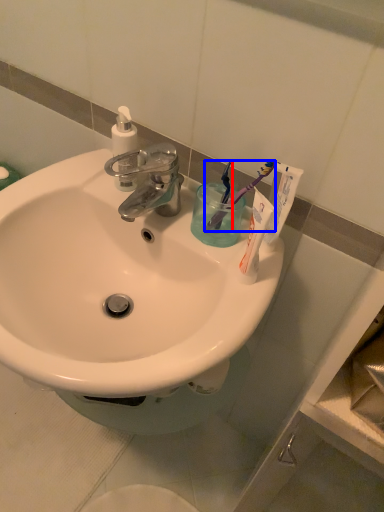
Question: Which object is closer to the camera taking this photo, toothbrush (highlighted by a red box) or toothbrush (highlighted by a blue box)?

Choices:
 (A) toothbrush
 (B) toothbrush

Answer: (B)